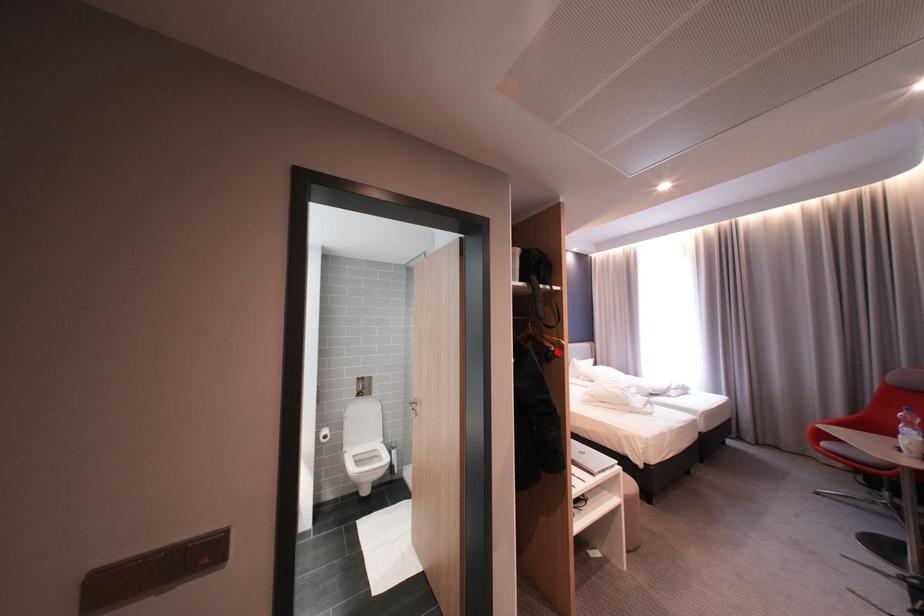
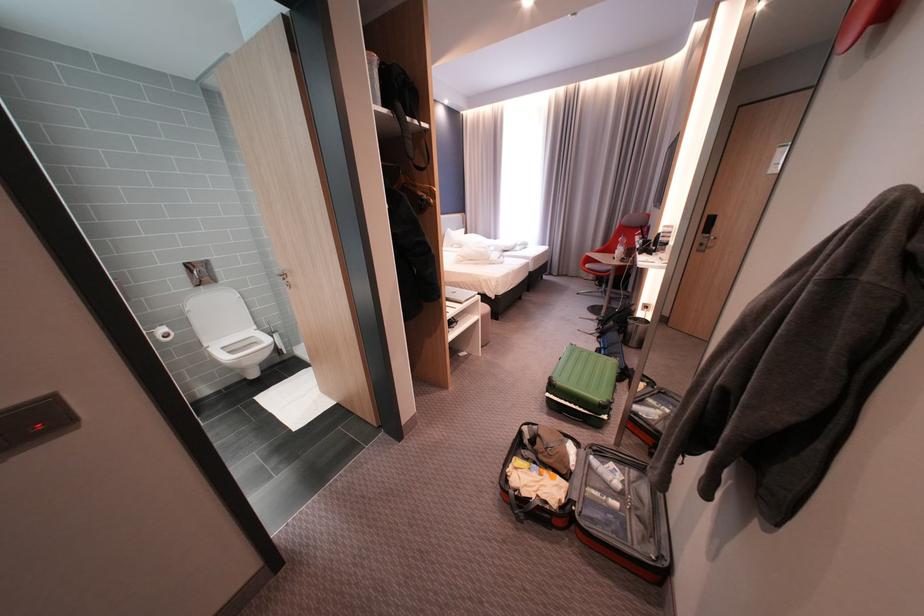
Question: I am providing you with two images of the same scene from different viewpoints. Given a red point in image1, look at the same physical point in image2. Is it:

Choices:
 (A) Closer to the viewpoint
 (B) Farther from the viewpoint

Answer: (A)